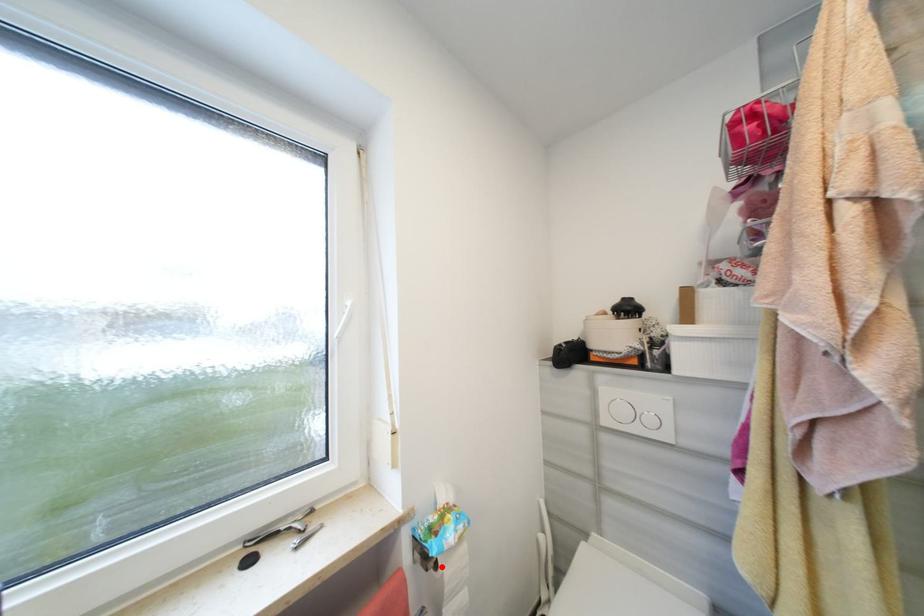
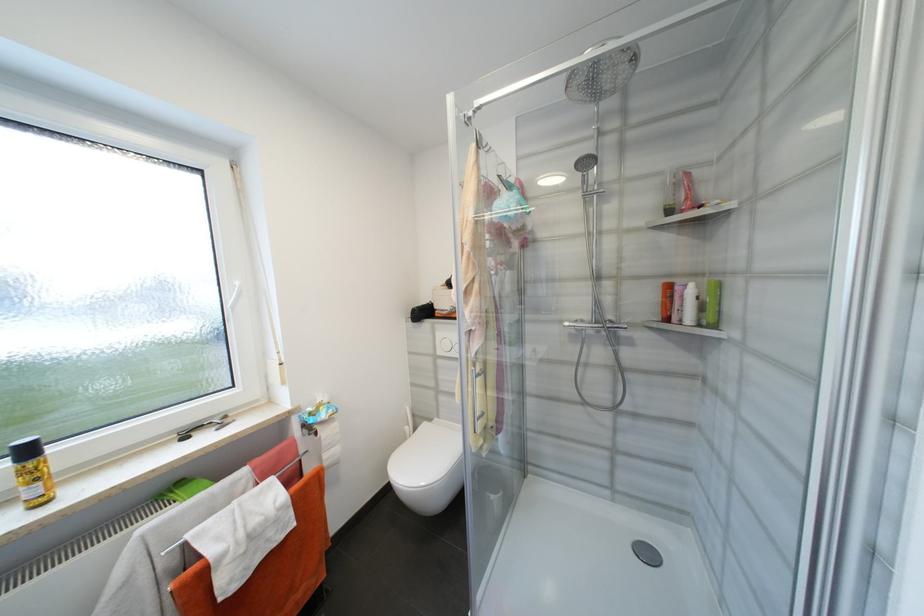
Where in the second image is the point corresponding to the highlighted location from the first image?

(322, 435)